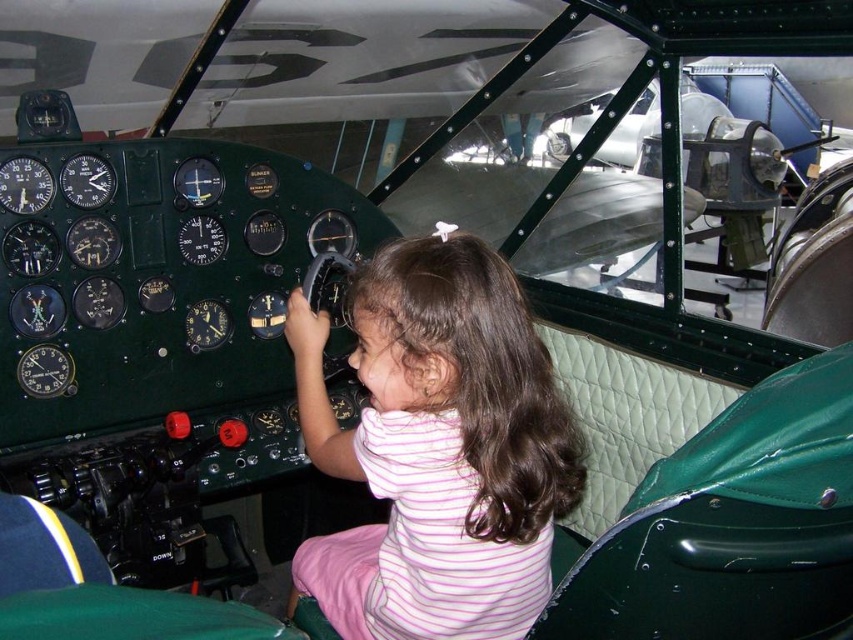
You are a flight attendant checking the cockpit for safety. You notice the pink striped shirt at center and the green leather seat at lower left. Which object takes up more space in the cockpit?

The pink striped shirt at center is bigger than the green leather seat at lower left, so it takes up more space in the cockpit.

You are a flight attendant checking the cockpit for safety. You notice the pink striped shirt at center and the green leather seat at lower left. Which object is higher in height?

The pink striped shirt at center is taller than the green leather seat at lower left.